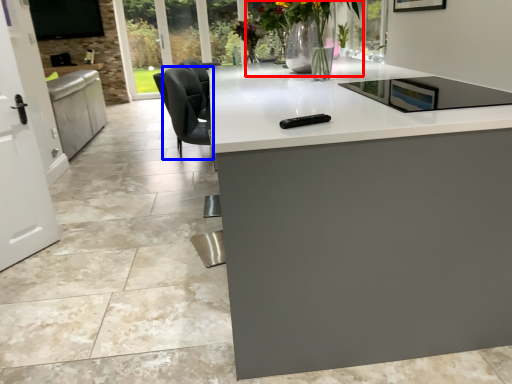
Question: Which of the following is the farthest to the observer, floral arrangement (highlighted by a red box) or swivel chair (highlighted by a blue box)?

Choices:
 (A) floral arrangement
 (B) swivel chair

Answer: (B)